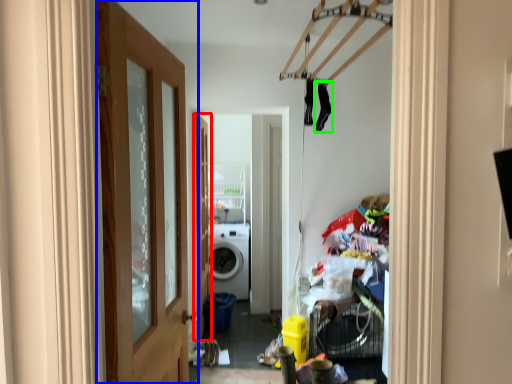
Question: Which object is positioned farthest from door (highlighted by a red box)? Select from door (highlighted by a blue box) and clothing (highlighted by a green box).

Choices:
 (A) door
 (B) clothing

Answer: (A)